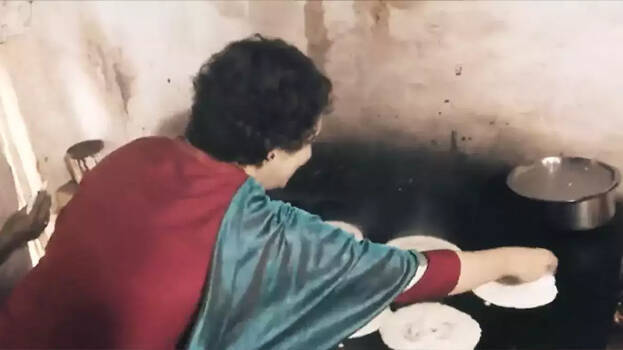
You are a GUI agent. You are given a task and a screenshot of the screen. Output one action in this format:
    pyautogui.click(x=<x>, y=<y>)
    Task: Click on the plate
    
    Given the screenshot: What is the action you would take?
    pyautogui.click(x=422, y=243), pyautogui.click(x=530, y=306), pyautogui.click(x=439, y=335), pyautogui.click(x=348, y=224), pyautogui.click(x=374, y=322)